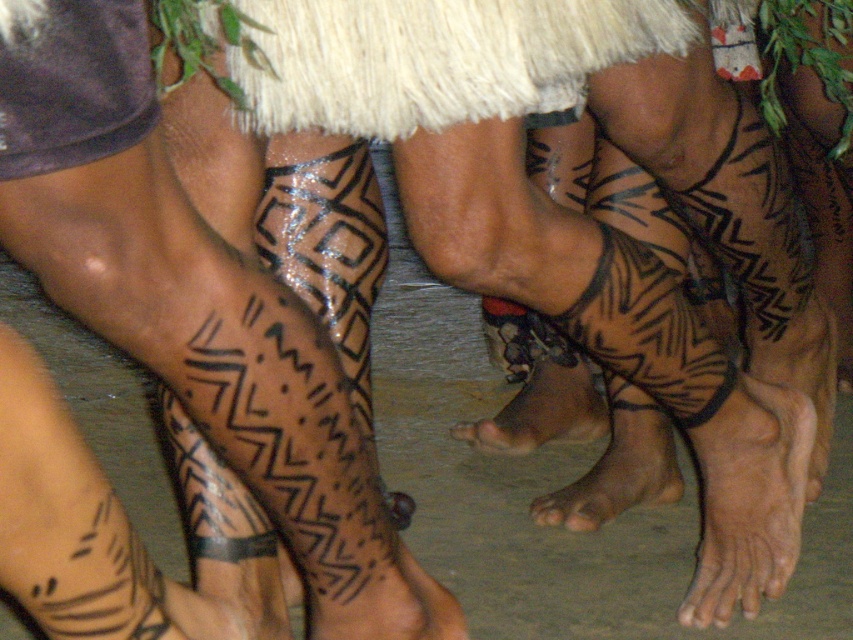
Question: Considering the relative positions of skinny flesh-toned foot at lower right and brown skin at lower center in the image provided, where is skinny flesh-toned foot at lower right located with respect to brown skin at lower center?

Choices:
 (A) left
 (B) right

Answer: (B)

Question: Is skinny flesh-toned foot at lower right to the left of brown skin at lower center from the viewer's perspective?

Choices:
 (A) yes
 (B) no

Answer: (B)

Question: Can you confirm if skinny flesh-toned foot at lower right is thinner than brown skin at lower center?

Choices:
 (A) no
 (B) yes

Answer: (B)

Question: Which object appears farthest from the camera in this image?

Choices:
 (A) skinny flesh-toned foot at lower right
 (B) brown skin at lower center

Answer: (B)

Question: Which of the following is the closest to the observer?

Choices:
 (A) (596, 422)
 (B) (747, 385)

Answer: (B)